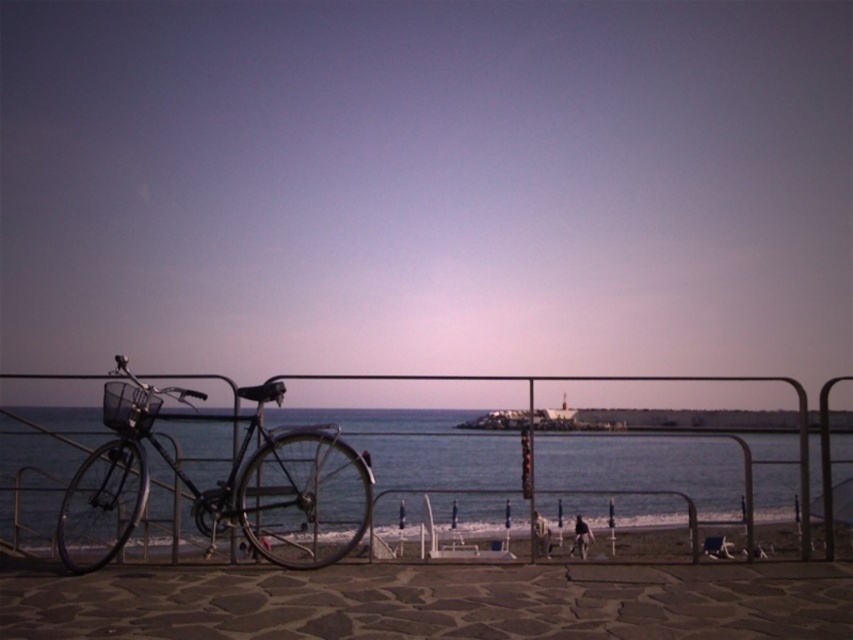
Can you confirm if blue water at center is wider than shiny black bicycle at left?

Correct, the width of blue water at center exceeds that of shiny black bicycle at left.

Is point (641, 452) in front of point (236, 452)?

No, it is not.

Where is `blue water at center`? blue water at center is located at coordinates (645, 467).